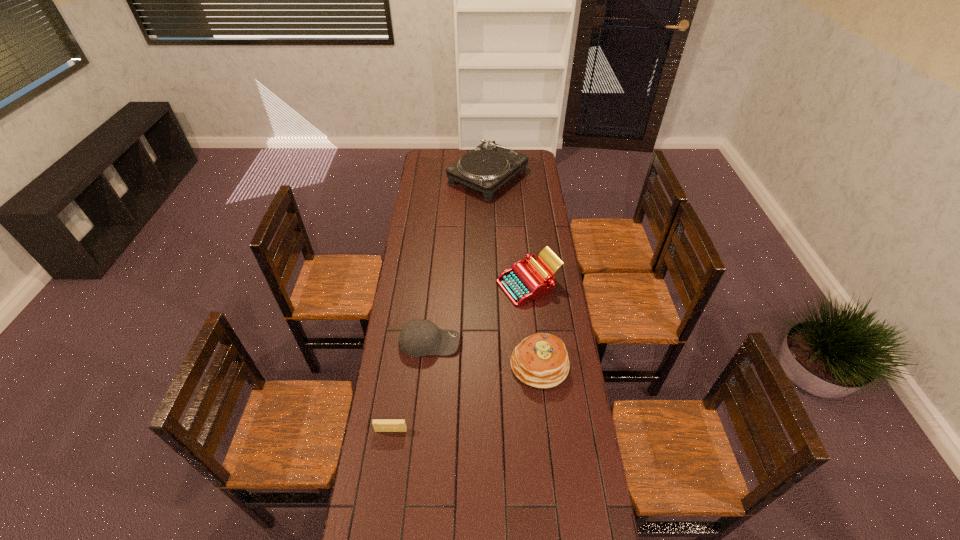
Where is `blank space that satisfies the following two spatial constraints: 1. on the back side of the pancake; 2. on the typing side of the typewriter`? The width and height of the screenshot is (960, 540). blank space that satisfies the following two spatial constraints: 1. on the back side of the pancake; 2. on the typing side of the typewriter is located at coordinates (531, 285).